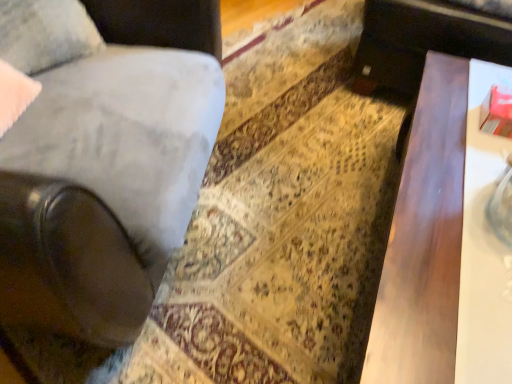
Question: Considering the relative sizes of velvet gray pillow at upper left and dark wood table at right in the image provided, is velvet gray pillow at upper left bigger than dark wood table at right?

Choices:
 (A) no
 (B) yes

Answer: (A)

Question: Considering the relative positions of velvet gray pillow at upper left and dark wood table at right in the image provided, is velvet gray pillow at upper left to the right of dark wood table at right from the viewer's perspective?

Choices:
 (A) no
 (B) yes

Answer: (A)

Question: From the image's perspective, is velvet gray pillow at upper left over dark wood table at right?

Choices:
 (A) yes
 (B) no

Answer: (A)

Question: Is velvet gray pillow at upper left shorter than dark wood table at right?

Choices:
 (A) no
 (B) yes

Answer: (B)

Question: From a real-world perspective, is velvet gray pillow at upper left below dark wood table at right?

Choices:
 (A) no
 (B) yes

Answer: (A)

Question: From their relative heights in the image, would you say velvet gray pillow at upper left is taller or shorter than dark wood table at right?

Choices:
 (A) short
 (B) tall

Answer: (A)

Question: From a real-world perspective, is velvet gray pillow at upper left physically located above or below dark wood table at right?

Choices:
 (A) above
 (B) below

Answer: (A)

Question: Is velvet gray pillow at upper left inside or outside of dark wood table at right?

Choices:
 (A) outside
 (B) inside

Answer: (A)

Question: In terms of width, does velvet gray pillow at upper left look wider or thinner when compared to dark wood table at right?

Choices:
 (A) wide
 (B) thin

Answer: (B)

Question: Considering the relative positions of suede-like gray chair at left and velvet gray pillow at upper left in the image provided, is suede-like gray chair at left to the left or to the right of velvet gray pillow at upper left?

Choices:
 (A) right
 (B) left

Answer: (B)

Question: Relative to velvet gray pillow at upper left, is suede-like gray chair at left in front or behind?

Choices:
 (A) behind
 (B) front

Answer: (B)

Question: Considering the positions of point (x=139, y=94) and point (x=15, y=23), is point (x=139, y=94) closer or farther from the camera than point (x=15, y=23)?

Choices:
 (A) farther
 (B) closer

Answer: (A)

Question: Considering the positions of suede-like gray chair at left and velvet gray pillow at upper left in the image, is suede-like gray chair at left wider or thinner than velvet gray pillow at upper left?

Choices:
 (A) thin
 (B) wide

Answer: (B)

Question: In terms of width, does velvet gray pillow at upper left look wider or thinner when compared to suede-like gray chair at left?

Choices:
 (A) wide
 (B) thin

Answer: (B)

Question: From a real-world perspective, is velvet gray pillow at upper left physically located above or below suede-like gray chair at left?

Choices:
 (A) above
 (B) below

Answer: (A)